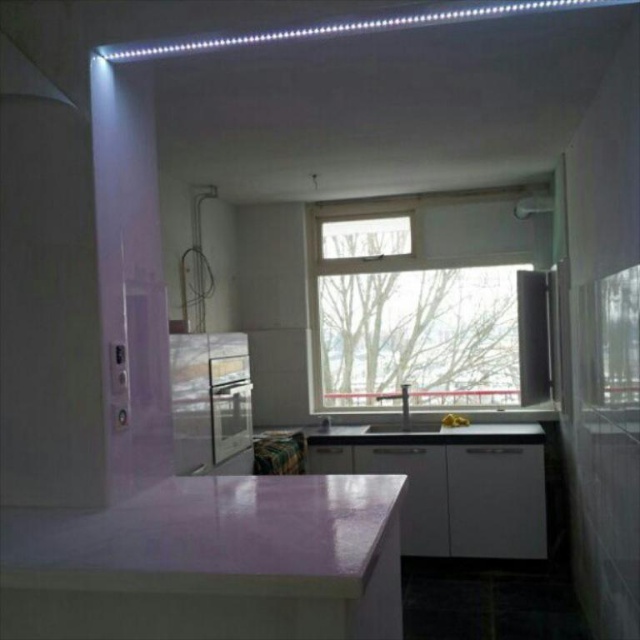
You are standing in the kitchen and want to wash your hands. You see the transparent glass window at center and the white glossy sink at center. Which object should you use?

You should use the white glossy sink at center to wash your hands because it is a sink, while the transparent glass window at center is a window and cannot be used for washing hands.

You are standing in the modern kitchen described. There is a point at coordinates (x=417, y=298). Which object is located at that point?

The point at coordinates (x=417, y=298) corresponds to the transparent glass window at center.

You are standing in the kitchen and want to look outside through the transparent glass window at center. However, there is a metallic stainless steel sink at center in the way. Can you see through the window without moving the sink?

The transparent glass window at center is further to the viewer than the metallic stainless steel sink at center, so the sink is blocking the view of the window. Therefore, you cannot see through the window without moving the sink.